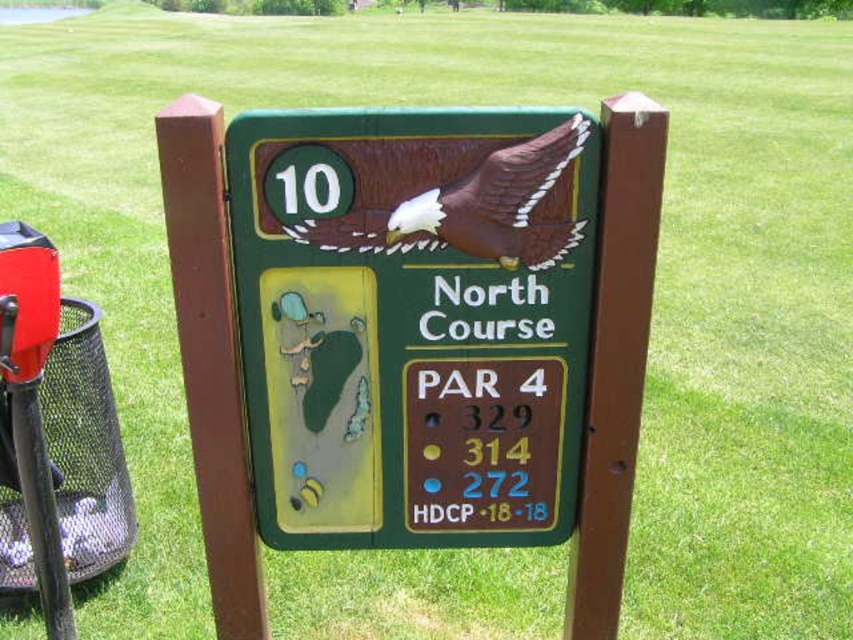
Can you confirm if brown matte eagle at center is thinner than brown wood post at center?

No.

Is brown matte eagle at center to the left of brown wood post at center from the viewer's perspective?

In fact, brown matte eagle at center is to the right of brown wood post at center.

The height and width of the screenshot is (640, 853). I want to click on brown matte eagle at center, so click(x=428, y=193).

Does point (519, 257) come farther from viewer compared to point (287, 145)?

Yes, point (519, 257) is behind point (287, 145).

Identify the location of green matte sign at center. Image resolution: width=853 pixels, height=640 pixels. (413, 321).

Between green matte sign at center and brown wood post at center, which one has less height?

Standing shorter between the two is green matte sign at center.

Can you confirm if green matte sign at center is positioned to the left of brown wood post at center?

No, green matte sign at center is not to the left of brown wood post at center.

Find the location of `green matte sign at center`. green matte sign at center is located at coordinates (413, 321).